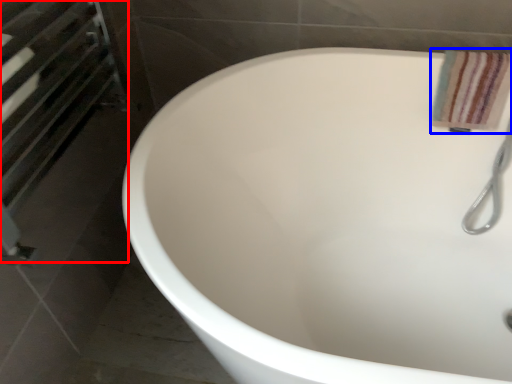
Question: Which object is closer to the camera taking this photo, screen door (highlighted by a red box) or bath towel (highlighted by a blue box)?

Choices:
 (A) screen door
 (B) bath towel

Answer: (A)